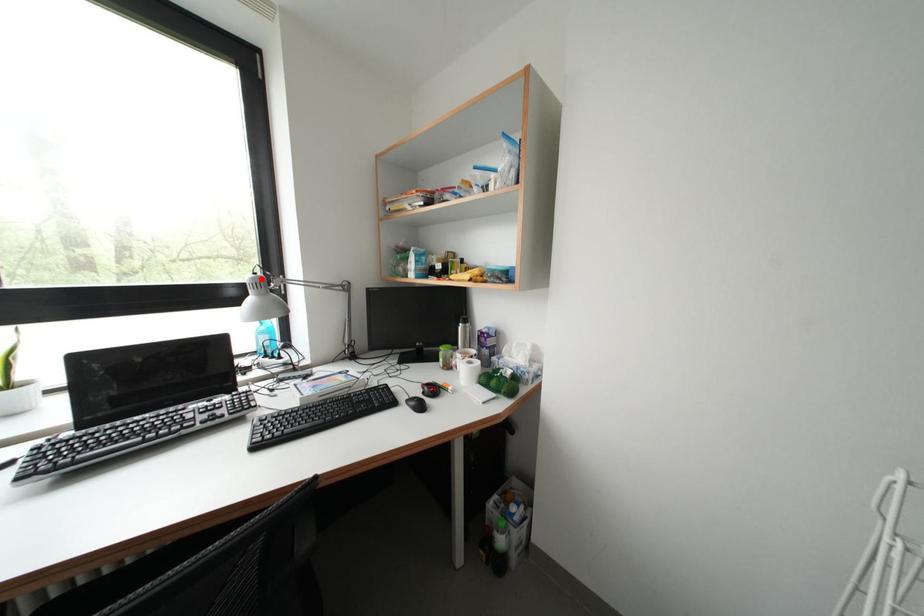
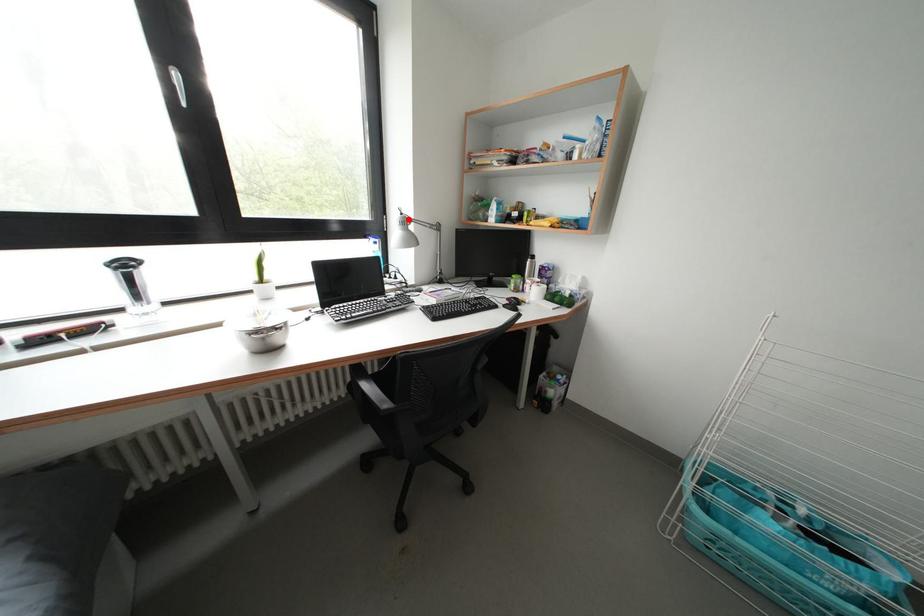
I am providing you with two images of the same scene from different viewpoints. A red point is marked on the first image and another point is marked on the second image. Is the red point in image1 aligned with the point shown in image2?

Yes